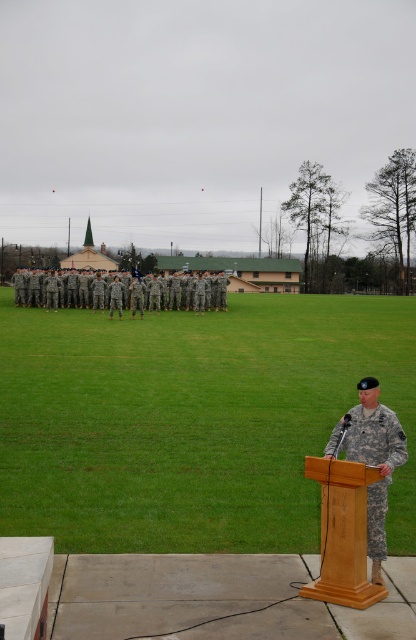
Question: Is camouflage fabric uniform at right bigger than camouflage uniform at center?

Choices:
 (A) no
 (B) yes

Answer: (A)

Question: Among these points, which one is nearest to the camera?

Choices:
 (A) (368, 504)
 (B) (351, 468)

Answer: (B)

Question: Which of the following is the farthest from the observer?

Choices:
 (A) (22, 284)
 (B) (354, 440)
 (C) (358, 576)

Answer: (A)

Question: Is wooden podium at lower right positioned at the back of camouflage fabric uniform at right?

Choices:
 (A) yes
 (B) no

Answer: (B)

Question: Does camouflage fabric uniform at right appear on the left side of camouflage uniform at center?

Choices:
 (A) yes
 (B) no

Answer: (B)

Question: Which object is positioned farthest from the camouflage uniform at center?

Choices:
 (A) camouflage fabric uniform at right
 (B) wooden podium at lower right

Answer: (A)